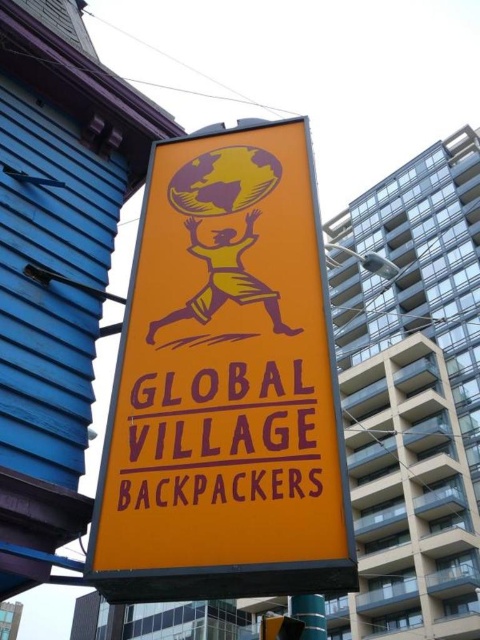
Question: Estimate the real-world distances between objects in this image. Which object is closer to the metallic blue pole at lower center?

Choices:
 (A) orange matte signboard at center
 (B) purple matte sign at center

Answer: (B)

Question: Can you confirm if purple matte sign at center is smaller than metallic blue pole at lower center?

Choices:
 (A) no
 (B) yes

Answer: (B)

Question: Is purple matte sign at center to the right of metallic blue pole at lower center from the viewer's perspective?

Choices:
 (A) yes
 (B) no

Answer: (B)

Question: Which object is the closest to the orange matte signboard at center?

Choices:
 (A) metallic blue pole at lower center
 (B) purple matte sign at center

Answer: (B)

Question: Can you confirm if purple matte sign at center is positioned to the left of metallic blue pole at lower center?

Choices:
 (A) yes
 (B) no

Answer: (A)

Question: Which object is the farthest from the orange matte signboard at center?

Choices:
 (A) metallic blue pole at lower center
 (B) purple matte sign at center

Answer: (A)